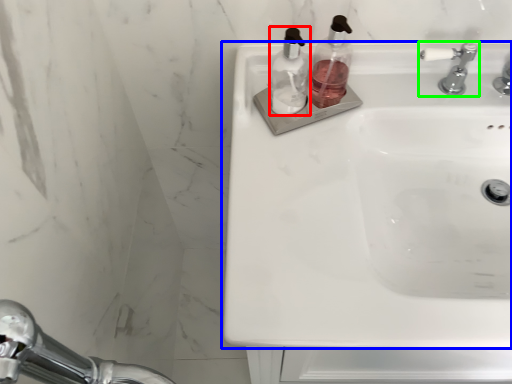
Question: Which is farther away from soap dispenser (highlighted by a red box)? sink (highlighted by a blue box) or tap (highlighted by a green box)?

Choices:
 (A) sink
 (B) tap

Answer: (B)